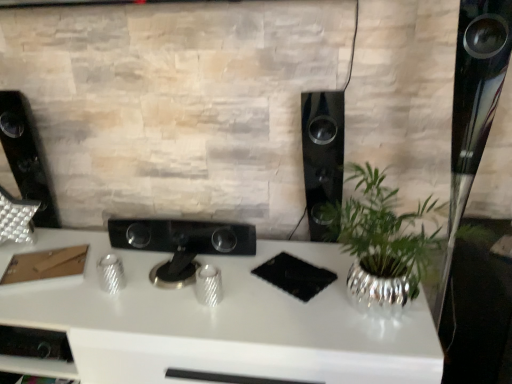
Question: Can you confirm if white glossy desk at center is positioned to the right of black glossy controller at center?

Choices:
 (A) no
 (B) yes

Answer: (A)

Question: Can you confirm if white glossy desk at center is wider than black glossy controller at center?

Choices:
 (A) yes
 (B) no

Answer: (A)

Question: Does white glossy desk at center have a lesser height compared to black glossy controller at center?

Choices:
 (A) no
 (B) yes

Answer: (A)

Question: Does white glossy desk at center come behind black glossy controller at center?

Choices:
 (A) no
 (B) yes

Answer: (A)

Question: Does white glossy desk at center have a greater height compared to black glossy controller at center?

Choices:
 (A) yes
 (B) no

Answer: (A)

Question: Is white glossy desk at center inside the boundaries of black glossy controller at center, or outside?

Choices:
 (A) outside
 (B) inside

Answer: (A)

Question: In the image, is white glossy desk at center positioned in front of or behind black glossy controller at center?

Choices:
 (A) front
 (B) behind

Answer: (A)

Question: From a real-world perspective, relative to black glossy controller at center, is white glossy desk at center vertically above or below?

Choices:
 (A) below
 (B) above

Answer: (A)

Question: From the image's perspective, relative to black glossy controller at center, is white glossy desk at center above or below?

Choices:
 (A) above
 (B) below

Answer: (B)

Question: Is point (249, 238) positioned closer to the camera than point (315, 163)?

Choices:
 (A) farther
 (B) closer

Answer: (A)

Question: From the image's perspective, is black glossy controller at center positioned above or below black glossy speaker at center-right, placed as the first speaker when sorted from right to left?

Choices:
 (A) above
 (B) below

Answer: (B)

Question: Relative to black glossy speaker at center-right, the second speaker positioned from the left, is black glossy controller at center in front or behind?

Choices:
 (A) front
 (B) behind

Answer: (B)

Question: Looking at the image, does black glossy controller at center seem bigger or smaller compared to black glossy speaker at center-right, placed as the first speaker when sorted from right to left?

Choices:
 (A) big
 (B) small

Answer: (A)

Question: From a real-world perspective, is black glossy speaker at center-right, the second speaker positioned from the left, physically located above or below black glossy controller at center?

Choices:
 (A) below
 (B) above

Answer: (B)

Question: In terms of height, does black glossy speaker at center-right, placed as the first speaker when sorted from right to left, look taller or shorter compared to black glossy controller at center?

Choices:
 (A) short
 (B) tall

Answer: (B)